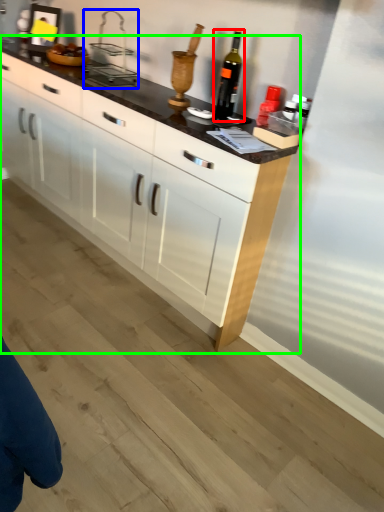
Question: Considering the real-world distances, which object is farthest from wine bottle (highlighted by a red box)? appliance (highlighted by a blue box) or cabinetry (highlighted by a green box)?

Choices:
 (A) appliance
 (B) cabinetry

Answer: (B)